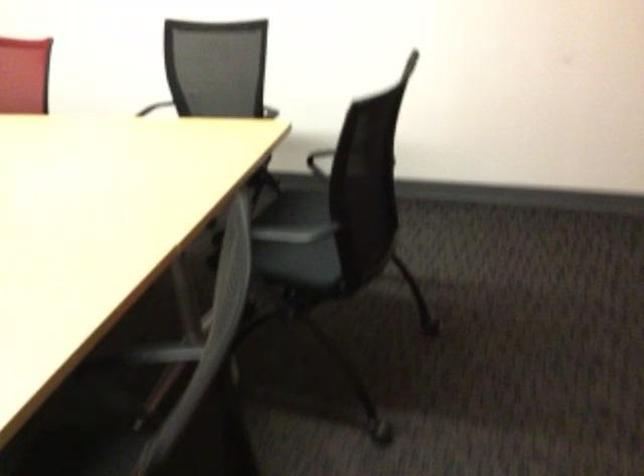
The height and width of the screenshot is (476, 644). In order to click on chair sitting surface in this screenshot , I will do `click(305, 262)`.